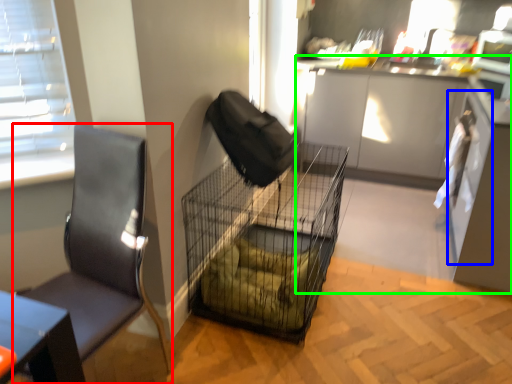
Question: Which object is positioned closest to chair (highlighted by a red box)? Select from screen door (highlighted by a blue box) and cabinetry (highlighted by a green box).

Choices:
 (A) screen door
 (B) cabinetry

Answer: (A)